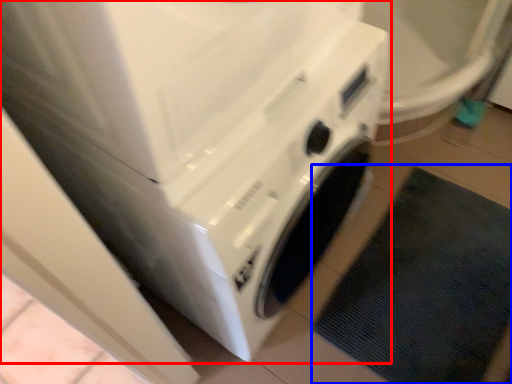
Question: Which point is closer to the camera, washing machine (highlighted by a red box) or bath mat (highlighted by a blue box)?

Choices:
 (A) washing machine
 (B) bath mat

Answer: (A)